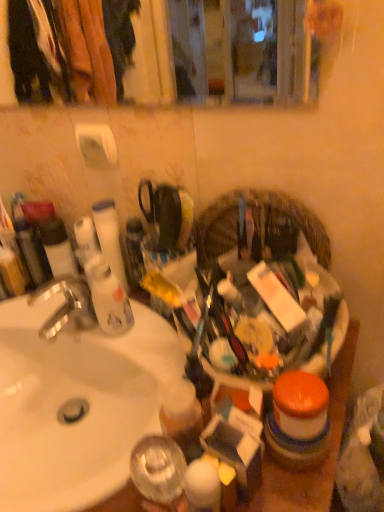
Question: Considering the relative sizes of matte black tube at left and white matte toilet paper at upper left, the 1th toilet paper in the top-to-bottom sequence, in the image provided, is matte black tube at left taller than white matte toilet paper at upper left, the 1th toilet paper in the top-to-bottom sequence,?

Choices:
 (A) no
 (B) yes

Answer: (B)

Question: Is matte black tube at left not close to white matte toilet paper at upper left, the second toilet paper from the bottom?

Choices:
 (A) no
 (B) yes

Answer: (A)

Question: Is matte black tube at left smaller than white matte toilet paper at upper left, the second toilet paper from the bottom?

Choices:
 (A) yes
 (B) no

Answer: (B)

Question: Is matte black tube at left looking in the opposite direction of white matte toilet paper at upper left, the 1th toilet paper in the top-to-bottom sequence?

Choices:
 (A) yes
 (B) no

Answer: (B)

Question: Is matte black tube at left in front of white matte toilet paper at upper left, the second toilet paper from the bottom?

Choices:
 (A) yes
 (B) no

Answer: (B)

Question: Is matte black tube at left located outside white matte toilet paper at upper left, the second toilet paper from the bottom?

Choices:
 (A) no
 (B) yes

Answer: (B)

Question: From the image's perspective, is plastic woven basket at center above matte black tube at left?

Choices:
 (A) yes
 (B) no

Answer: (A)

Question: Is plastic woven basket at center oriented away from matte black tube at left?

Choices:
 (A) no
 (B) yes

Answer: (A)

Question: Can you confirm if plastic woven basket at center is positioned to the right of matte black tube at left?

Choices:
 (A) yes
 (B) no

Answer: (A)

Question: Is plastic woven basket at center not within matte black tube at left?

Choices:
 (A) no
 (B) yes

Answer: (B)

Question: Can you confirm if plastic woven basket at center is shorter than matte black tube at left?

Choices:
 (A) no
 (B) yes

Answer: (A)

Question: Is plastic woven basket at center facing towards matte black tube at left?

Choices:
 (A) no
 (B) yes

Answer: (A)

Question: Is matte black tube at left in front of plastic woven basket at center?

Choices:
 (A) no
 (B) yes

Answer: (A)